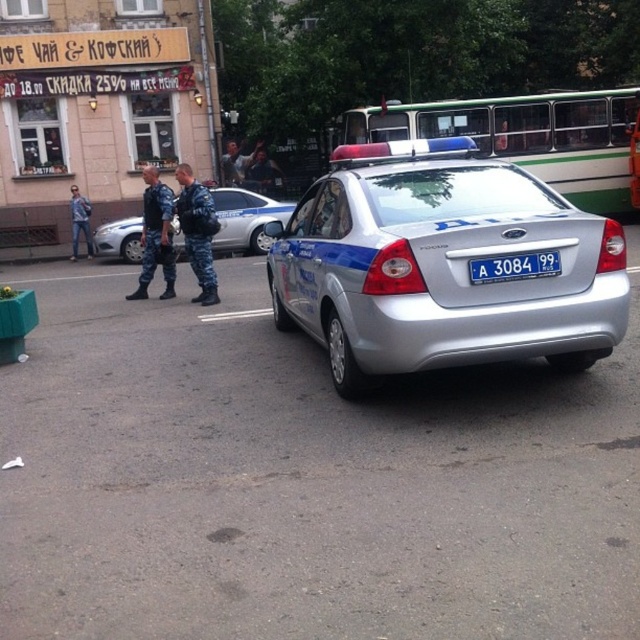
You are a delivery person who needs to park your motorcycle between the silver metallic sedan at center and the camouflage uniform at center. Can you fit your motorcycle between them?

The silver metallic sedan at center is bigger than camouflage uniform at center. Since the motorcycle needs space between them, the size difference may affect the available space. However, without exact measurements, it is uncertain if the motorcycle will fit. Please check the actual distance between them.

You are a delivery driver who needs to park your vehicle near the police car at point (442, 266). The parking spot you choose must be within 0.1 units of this coordinate. Is there enough space to park your car here?

The silver metallic police car at center is located at point (442, 266). Since the parking spot must be within 0.1 units of this coordinate, and the police car is exactly at that point, there is no space to park your car here as it would overlap with the police car.

You are a photographer trying to capture the silver metallic sedan at center and the white plastic license plate at center in a single shot. Given that the sedan is wider than the license plate, which object will occupy more space in the photo?

The silver metallic sedan at center will occupy more space in the photo because its width surpasses that of the white plastic license plate at center.